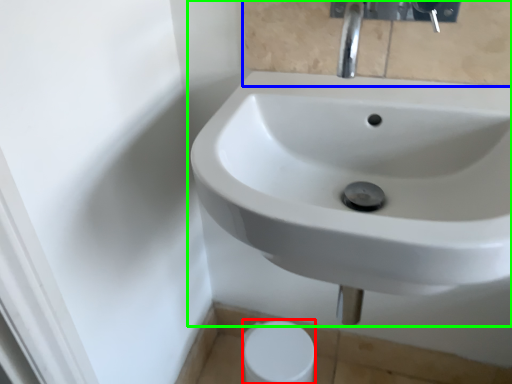
Question: Based on their relative distances, which object is farther from toilet paper (highlighted by a red box)? Choose from mirror (highlighted by a blue box) and sink (highlighted by a green box).

Choices:
 (A) mirror
 (B) sink

Answer: (A)